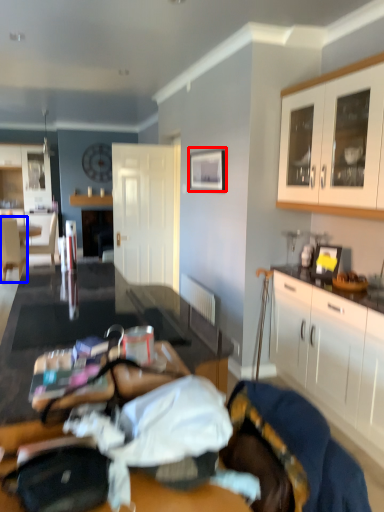
Question: Which of the following is the farthest to the observer, picture frame (highlighted by a red box) or chair (highlighted by a blue box)?

Choices:
 (A) picture frame
 (B) chair

Answer: (B)